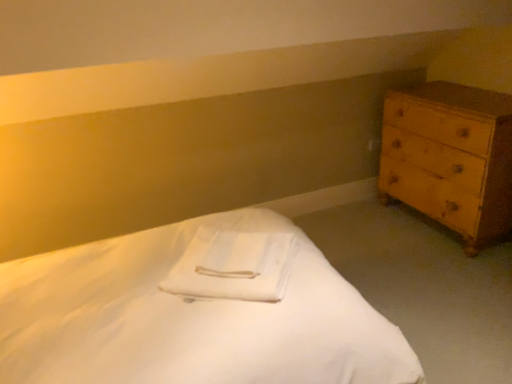
Question: Looking at the image, does white smooth bed at center seem bigger or smaller compared to light brown wooden chest of drawers at right?

Choices:
 (A) small
 (B) big

Answer: (B)

Question: Considering the positions of white smooth bed at center and light brown wooden chest of drawers at right in the image, is white smooth bed at center wider or thinner than light brown wooden chest of drawers at right?

Choices:
 (A) wide
 (B) thin

Answer: (A)

Question: Which object is the farthest from the light brown wooden chest of drawers at right?

Choices:
 (A) white smooth bed at center
 (B) white soft towel at center

Answer: (A)

Question: Estimate the real-world distances between objects in this image. Which object is farther from the white smooth bed at center?

Choices:
 (A) light brown wooden chest of drawers at right
 (B) white soft towel at center

Answer: (A)